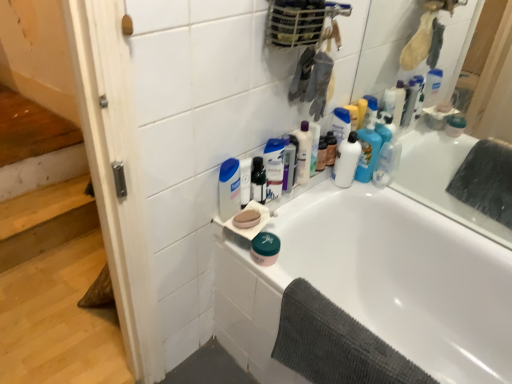
Measure the distance between white glossy bathtub at upper right and camera.

They are 3.93 feet apart.

Describe the element at coordinates (115, 171) in the screenshot. I see `white wood screen door at left` at that location.

Measure the distance between point (x=259, y=217) and camera.

They are 1.31 meters apart.

This screenshot has width=512, height=384. I want to click on clear plastic bottle at upper center, acting as the second cleaning product starting from the back, so click(x=303, y=152).

From a real-world perspective, is clear plastic bottle at upper center, the 2th cleaning product when ordered from left to right, above or below white glossy bottle at upper right, placed as the first cleaning product when sorted from back to front?

Clearly, from a real-world perspective, clear plastic bottle at upper center, the 2th cleaning product when ordered from left to right, is above white glossy bottle at upper right, placed as the first cleaning product when sorted from back to front.

Based on the photo, measure the distance from clear plastic bottle at upper center, the 2th cleaning product when ordered from left to right, to white glossy bottle at upper right, which is the third cleaning product in front-to-back order.

6.41 inches.

How different are the orientations of clear plastic bottle at upper center, the 2th cleaning product when ordered from left to right, and white glossy bottle at upper right, placed as the first cleaning product when sorted from back to front, in degrees?

The angle between the facing direction of clear plastic bottle at upper center, the 2th cleaning product when ordered from left to right, and the facing direction of white glossy bottle at upper right, placed as the first cleaning product when sorted from back to front, is 3.14 degrees.

Find the location of a particular element. cleaning product that is on the right side of clear plastic bottle at upper center, the 2th cleaning product when ordered from left to right is located at coordinates (346, 161).

Considering the relative sizes of white matte lotion at upper right, the first cleaning product in the front-to-back sequence, and white matte shaving cream at upper center in the image provided, is white matte lotion at upper right, the first cleaning product in the front-to-back sequence, bigger than white matte shaving cream at upper center?

Indeed, white matte lotion at upper right, the first cleaning product in the front-to-back sequence, has a larger size compared to white matte shaving cream at upper center.

In terms of height, does white matte lotion at upper right, which is counted as the 3th cleaning product, starting from the back, look taller or shorter compared to white matte shaving cream at upper center?

Clearly, white matte lotion at upper right, which is counted as the 3th cleaning product, starting from the back, is shorter compared to white matte shaving cream at upper center.

From a real-world perspective, which is physically above, white matte lotion at upper right, which is counted as the 3th cleaning product, starting from the back, or white matte shaving cream at upper center?

From a 3D spatial view, white matte lotion at upper right, which is counted as the 3th cleaning product, starting from the back, is above.

Is white matte lotion at upper right, which is the 1th cleaning product from left to right, facing towards white matte shaving cream at upper center?

No, white matte lotion at upper right, which is the 1th cleaning product from left to right, is not turned towards white matte shaving cream at upper center.

Between green matte jar at lower center and white glossy bathtub at upper right, which one appears on the left side from the viewer's perspective?

green matte jar at lower center.

From a real-world perspective, is green matte jar at lower center beneath white glossy bathtub at upper right?

No.

Is green matte jar at lower center situated inside white glossy bathtub at upper right or outside?

green matte jar at lower center is not inside white glossy bathtub at upper right, it's outside.

Is the surface of dark gray textured towel at lower right in direct contact with pink matte soap at upper center?

No, dark gray textured towel at lower right is not with pink matte soap at upper center.

Which of these two, dark gray textured towel at lower right or pink matte soap at upper center, is smaller?

With smaller size is pink matte soap at upper center.

From the image's perspective, does dark gray textured towel at lower right appear lower than pink matte soap at upper center?

Correct, dark gray textured towel at lower right appears lower than pink matte soap at upper center in the image.

Does point (368, 348) come behind point (254, 220)?

No, (368, 348) is in front of (254, 220).

Can you confirm if white glossy bottle at upper right, acting as the third cleaning product starting from the left, is thinner than pink matte soap at upper center?

No, white glossy bottle at upper right, acting as the third cleaning product starting from the left, is not thinner than pink matte soap at upper center.

Is white glossy bottle at upper right, placed as the first cleaning product when sorted from back to front, looking in the opposite direction of pink matte soap at upper center?

No.

In terms of size, does white glossy bottle at upper right, which is the third cleaning product in front-to-back order, appear bigger or smaller than pink matte soap at upper center?

In the image, white glossy bottle at upper right, which is the third cleaning product in front-to-back order, appears to be larger than pink matte soap at upper center.

Find the location of a particular element. The width and height of the screenshot is (512, 384). screen door below the white matte shaving cream at upper center (from a real-world perspective) is located at coordinates (115, 171).

Considering the points (279, 161) and (116, 17), which point is behind, point (279, 161) or point (116, 17)?

Positioned behind is point (279, 161).

Considering the sizes of objects white matte shaving cream at upper center and white wood screen door at left in the image provided, who is taller, white matte shaving cream at upper center or white wood screen door at left?

white wood screen door at left is taller.

Could you tell me if white matte shaving cream at upper center is facing white wood screen door at left?

No, white matte shaving cream at upper center is not facing towards white wood screen door at left.

Where is `bath towel that is on the right side of white matte shaving cream at upper center`? bath towel that is on the right side of white matte shaving cream at upper center is located at coordinates (335, 344).

What's the angular difference between dark gray textured towel at lower right and white matte shaving cream at upper center's facing directions?

There is a 86.4-degree angle between the facing directions of dark gray textured towel at lower right and white matte shaving cream at upper center.

Is dark gray textured towel at lower right aimed at white matte shaving cream at upper center?

No, dark gray textured towel at lower right is not turned towards white matte shaving cream at upper center.

From a real-world perspective, who is located lower, dark gray textured towel at lower right or white matte shaving cream at upper center?

dark gray textured towel at lower right.

This screenshot has width=512, height=384. Identify the location of cleaning product that is on the right side of clear plastic bottle at upper center, which is the 2th cleaning product in right-to-left order. (346, 161).

This screenshot has height=384, width=512. Identify the location of cleaning product located on the left of white matte shaving cream at upper center. (229, 189).

Based on their spatial positions, is pink matte soap at upper center or wooden stairs at left further from white matte lotion at upper right, which is counted as the 3th cleaning product, starting from the back?

Among the two, wooden stairs at left is located further to white matte lotion at upper right, which is counted as the 3th cleaning product, starting from the back.

Which object lies nearer to the anchor point clear plastic bottle at upper center, the 2th cleaning product when ordered from left to right, pink matte soap at upper center or white matte lotion at upper right, marked as the third cleaning product in a right-to-left arrangement?

white matte lotion at upper right, marked as the third cleaning product in a right-to-left arrangement.

Estimate the real-world distances between objects in this image. Which object is further from pink matte soap at upper center, green matte jar at lower center or clear plastic bottle at upper center, acting as the second cleaning product starting from the back?

The object further to pink matte soap at upper center is clear plastic bottle at upper center, acting as the second cleaning product starting from the back.

In the scene shown: When comparing their distances from dark gray textured towel at lower right, does white matte shaving cream at upper center or white glossy bathtub at upper right seem further?

white matte shaving cream at upper center is positioned further to the anchor dark gray textured towel at lower right.

From the image, which object appears to be nearer to white matte lotion at upper right, marked as the third cleaning product in a right-to-left arrangement, white glossy bottle at upper right, which is the first cleaning product in right-to-left order, or white glossy bathtub at upper right?

white glossy bottle at upper right, which is the first cleaning product in right-to-left order, lies closer to white matte lotion at upper right, marked as the third cleaning product in a right-to-left arrangement, than the other object.

Looking at the image, which one is located closer to wooden stairs at left, white matte shaving cream at upper center or green matte jar at lower center?

Among the two, white matte shaving cream at upper center is located nearer to wooden stairs at left.

Considering their positions, is green matte jar at lower center positioned closer to pink matte soap at upper center than white glossy bottle at upper right, which is the third cleaning product in front-to-back order?

green matte jar at lower center is closer to pink matte soap at upper center.

From the image, which object appears to be nearer to white glossy bathtub at upper right, white matte lotion at upper right, which is the 1th cleaning product from left to right, or white matte shaving cream at upper center?

The object closer to white glossy bathtub at upper right is white matte shaving cream at upper center.

At what (x,y) coordinates should I click in order to perform the action: click on soap between wooden stairs at left and dark gray textured towel at lower right. Please return your answer as a coordinate pair (x, y). The width and height of the screenshot is (512, 384). Looking at the image, I should click on (247, 219).

Locate an element on the screen. The height and width of the screenshot is (384, 512). shaving cream between white matte lotion at upper right, marked as the third cleaning product in a right-to-left arrangement, and clear plastic bottle at upper center, the 2th cleaning product when ordered from left to right is located at coordinates (274, 167).

Find the location of a particular element. shaving cream between white matte lotion at upper right, the first cleaning product in the front-to-back sequence, and white glossy bottle at upper right, which is the third cleaning product in front-to-back order, from left to right is located at coordinates (274, 167).

The width and height of the screenshot is (512, 384). Find the location of `bathtub between white matte lotion at upper right, marked as the third cleaning product in a right-to-left arrangement, and dark gray textured towel at lower right in the up-down direction`. bathtub between white matte lotion at upper right, marked as the third cleaning product in a right-to-left arrangement, and dark gray textured towel at lower right in the up-down direction is located at coordinates (381, 271).